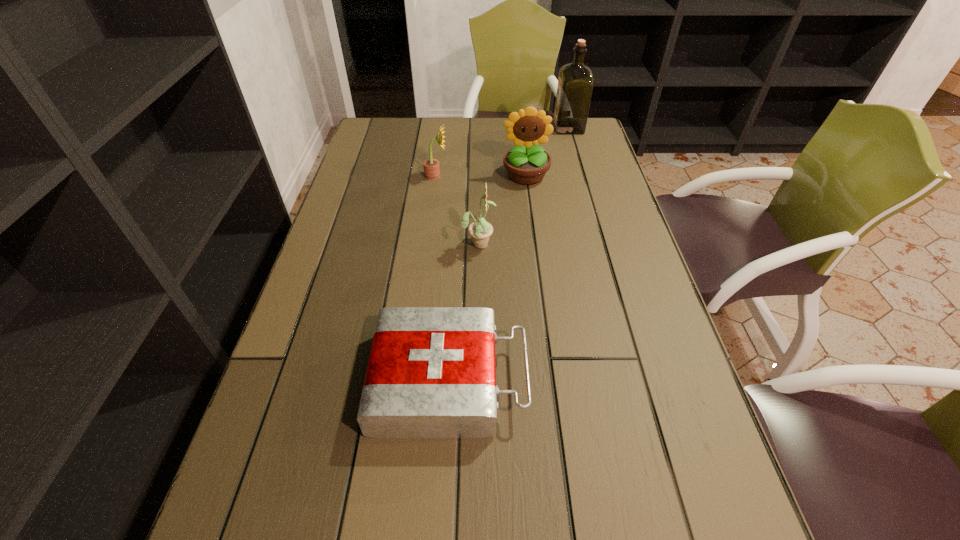
Where is `free region at the left edge of the desktop`? The width and height of the screenshot is (960, 540). free region at the left edge of the desktop is located at coordinates (359, 186).

This screenshot has width=960, height=540. Identify the location of free region at the right edge of the desktop. click(x=681, y=443).

Image resolution: width=960 pixels, height=540 pixels. In order to click on free location at the far left corner in this screenshot , I will do `click(368, 121)`.

Find the location of a particular element. The image size is (960, 540). free region at the far right corner of the desktop is located at coordinates (562, 134).

Locate an element on the screen. The height and width of the screenshot is (540, 960). free space between the second sunflower from left to right and the leftmost sunflower is located at coordinates (457, 209).

Find the location of a particular element. This screenshot has width=960, height=540. empty location between the tallest sunflower and the first-aid kit is located at coordinates (488, 278).

Where is `unoccupied position between the second sunflower from left to right and the leftmost sunflower`? The image size is (960, 540). unoccupied position between the second sunflower from left to right and the leftmost sunflower is located at coordinates [x=457, y=209].

Identify which object is the second nearest to the nearest object. Please provide its 2D coordinates. Your answer should be formatted as a tuple, i.e. [(x, y)], where the tuple contains the x and y coordinates of a point satisfying the conditions above.

[(527, 163)]

This screenshot has height=540, width=960. What are the coordinates of `object that stands as the closest to the rightmost sunflower` in the screenshot? It's located at (431, 166).

The height and width of the screenshot is (540, 960). Find the location of `the closest sunflower to the shortest object`. the closest sunflower to the shortest object is located at coordinates click(480, 230).